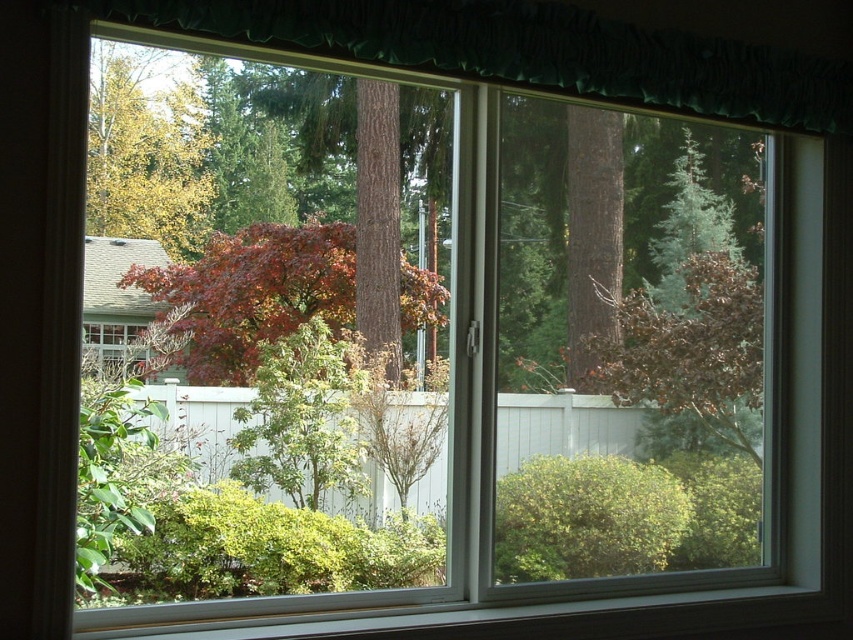
You are standing in a room and looking through the window. There is a point at coordinate (531,51). What object is located at that point?

The green textured curtain at upper center is located at point (531,51).

You are an interior designer assessing the window decor. You need to determine which object, the green textured curtain at upper center or the green matte tree at upper left, is shorter. Based on the scene, which one is shorter?

The green textured curtain at upper center is shorter than the green matte tree at upper left because the description states that the green textured curtain at upper center is not as tall as the green matte tree at upper left.